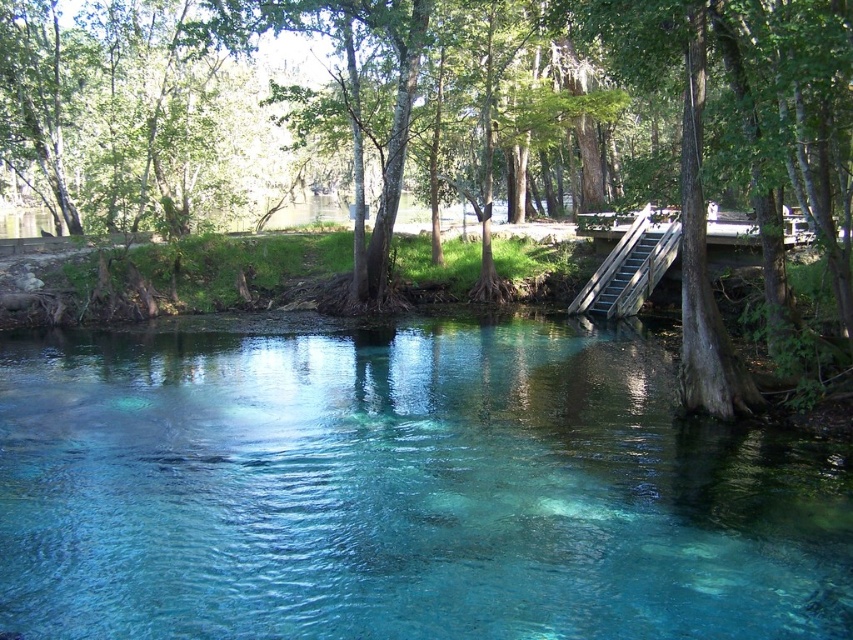
You are planning to build a small wooden platform for resting near the clear glassy water at center and the green rough bark tree at center. Which object is closer to the ground, requiring the platform to be built lower?

The clear glassy water at center is shorter than the green rough bark tree at center, so the platform should be built lower near the clear glassy water at center.